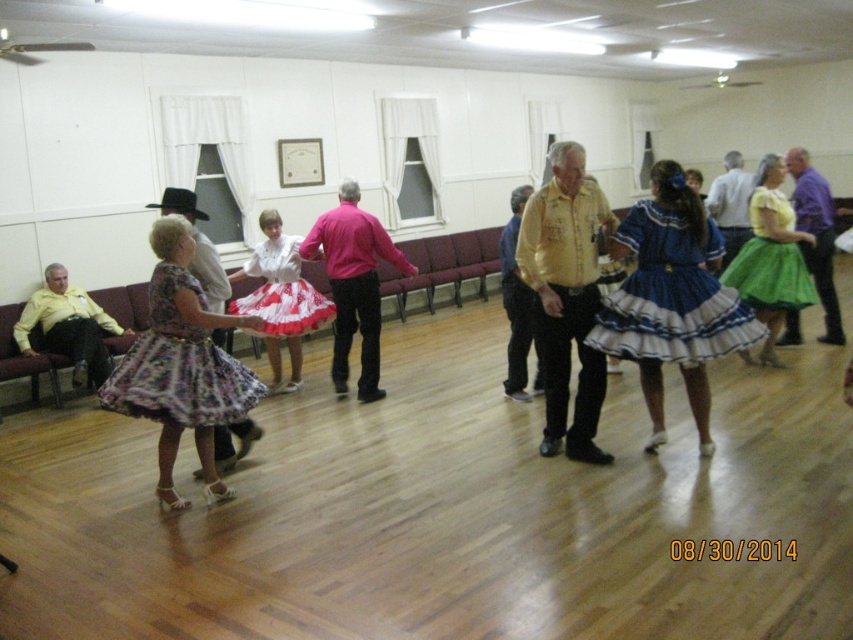
Question: Estimate the real-world distances between objects in this image. Which object is farther from the purple cotton shirt at center?

Choices:
 (A) pink satin shirt at center
 (B) matte yellow shirt at left

Answer: (B)

Question: Which object is farther from the camera taking this photo?

Choices:
 (A) matte yellow shirt at center
 (B) matte yellow shirt at left
 (C) blue satin dress at center
 (D) matte black cowboy hat at left

Answer: (A)

Question: Does matte yellow shirt at left appear under purple cotton shirt at center?

Choices:
 (A) yes
 (B) no

Answer: (A)

Question: Can you confirm if green satin skirt at center is bigger than yellow cotton shirt at center?

Choices:
 (A) no
 (B) yes

Answer: (A)

Question: Which of the following is the closest to the observer?

Choices:
 (A) (688, 285)
 (B) (215, 458)
 (C) (581, 160)
 (D) (125, 376)

Answer: (D)

Question: Does blue satin dress at center have a larger size compared to floral-patterned fabric skirt at center?

Choices:
 (A) yes
 (B) no

Answer: (A)